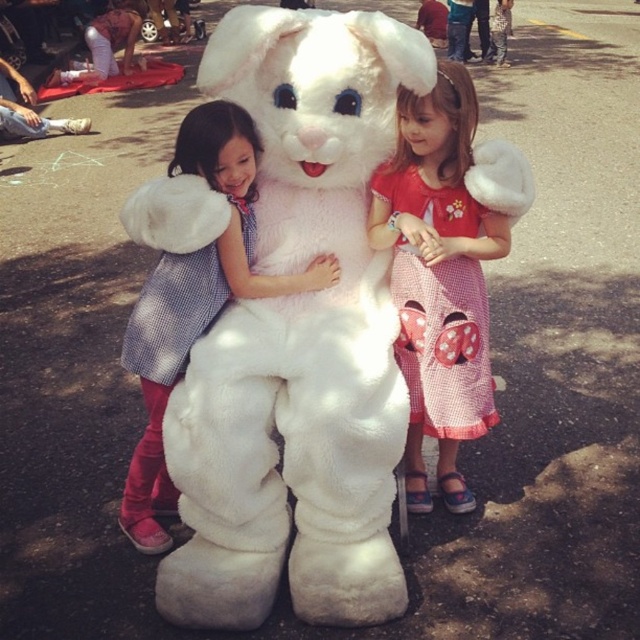
Question: Which point is closer to the camera?

Choices:
 (A) (182, 156)
 (B) (304, 355)
 (C) (385, 182)

Answer: (A)

Question: Considering the relative positions of velvety white coat at center and red checkered dress with bow at center in the image provided, where is velvety white coat at center located with respect to red checkered dress with bow at center?

Choices:
 (A) above
 (B) below

Answer: (B)

Question: Can you confirm if fluffy white bunny at center is positioned to the right of velvety white coat at center?

Choices:
 (A) yes
 (B) no

Answer: (A)

Question: Which point is closer to the camera?

Choices:
 (A) (138, 337)
 (B) (330, 44)
 (C) (400, 248)

Answer: (B)

Question: Estimate the real-world distances between objects in this image. Which object is farther from the red checkered dress with bow at center?

Choices:
 (A) velvety white coat at center
 (B) fluffy white bunny at center

Answer: (A)

Question: Can you confirm if fluffy white bunny at center is positioned to the left of velvety white coat at center?

Choices:
 (A) yes
 (B) no

Answer: (B)